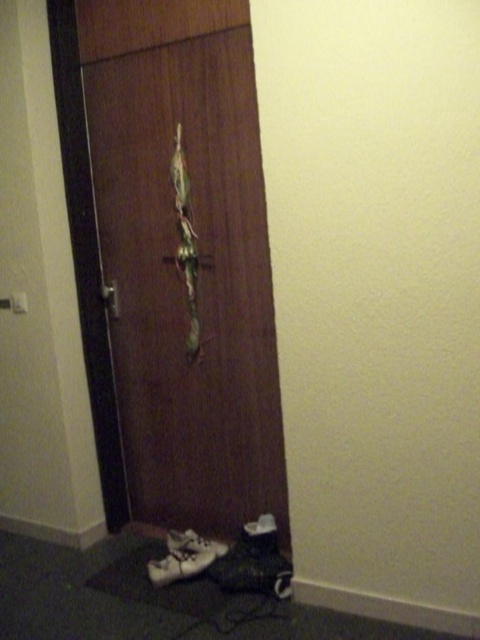
Does white leather shoe at lower left have a larger size compared to white matte shoe at lower left?

Yes.

Locate an element on the screen. This screenshot has width=480, height=640. white leather shoe at lower left is located at coordinates (183, 556).

At what (x,y) coordinates should I click in order to perform the action: click on white leather shoe at lower left. Please return your answer as a coordinate pair (x, y). The image size is (480, 640). Looking at the image, I should click on (183, 556).

The image size is (480, 640). In order to click on white leather shoe at lower left in this screenshot , I will do (183, 556).

Does wooden door at center have a lesser width compared to white matte shoe at lower left?

In fact, wooden door at center might be wider than white matte shoe at lower left.

Does wooden door at center have a greater width compared to white matte shoe at lower left?

Yes.

Does point (264, 506) come behind point (181, 548)?

Yes, point (264, 506) is behind point (181, 548).

This screenshot has height=640, width=480. I want to click on wooden door at center, so click(183, 284).

Consider the image. Is wooden door at center positioned behind white leather shoe at lower left?

No, wooden door at center is in front of white leather shoe at lower left.

Based on the photo, who is lower down, wooden door at center or white leather shoe at lower left?

white leather shoe at lower left is below.

Between point (213, 259) and point (190, 529), which one is positioned in front?

Point (213, 259)

You are a GUI agent. You are given a task and a screenshot of the screen. Output one action in this format:
    pyautogui.click(x=<x>, y=<y>)
    Task: Click on the wooden door at center
    This screenshot has width=480, height=640.
    Given the screenshot: What is the action you would take?
    pyautogui.click(x=183, y=284)